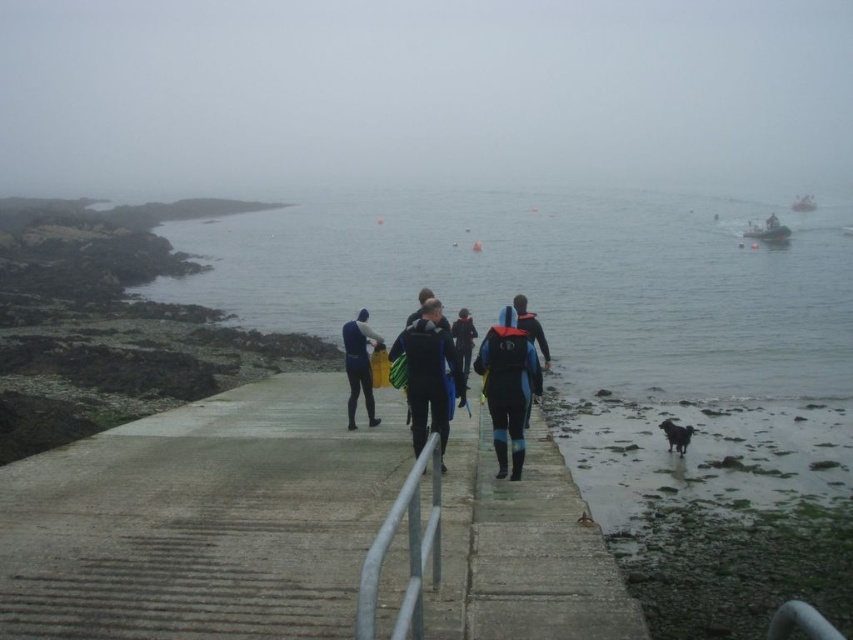
You are a diver preparing to enter the water. You see the clear water at center and the blue matte wetsuit at center. Which object is higher from the ground?

The clear water at center is taller than the blue matte wetsuit at center, so the clear water at center is higher from the ground.

You are a photographer positioned at the edge of the pier. You notice a point marked at coordinates (358, 365) in the image. Which object does this point correspond to?

The point at coordinates (358, 365) corresponds to the matte black wetsuit at center.